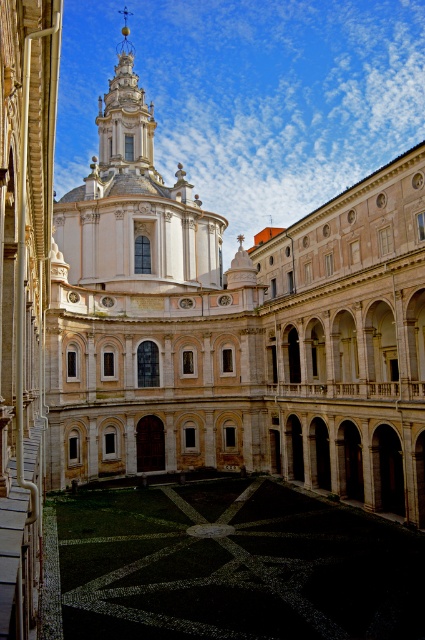
Question: Which object is closer to the camera taking this photo?

Choices:
 (A) white marble church at center
 (B) black mosaic courtyard at center

Answer: (B)

Question: Which point is closer to the camera?

Choices:
 (A) white marble church at center
 (B) black mosaic courtyard at center

Answer: (B)

Question: Does white marble church at center appear on the left side of black mosaic courtyard at center?

Choices:
 (A) yes
 (B) no

Answer: (A)

Question: Considering the relative positions of white marble church at center and black mosaic courtyard at center in the image provided, where is white marble church at center located with respect to black mosaic courtyard at center?

Choices:
 (A) left
 (B) right

Answer: (A)

Question: Which object is closer to the camera taking this photo?

Choices:
 (A) black mosaic courtyard at center
 (B) white marble church at center

Answer: (A)

Question: Can you confirm if white marble church at center is positioned to the left of black mosaic courtyard at center?

Choices:
 (A) no
 (B) yes

Answer: (B)